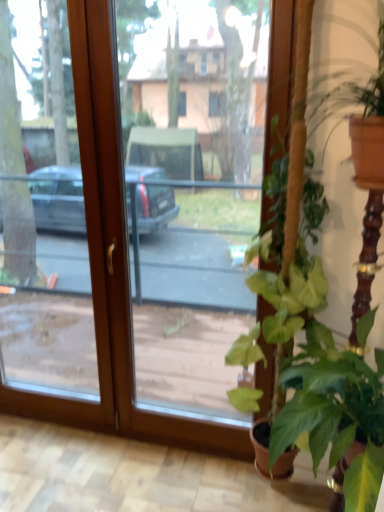
Describe the element at coordinates (355, 103) in the screenshot. I see `green leafy plant at right, acting as the first houseplant starting from the top` at that location.

Locate an element on the screen. green leafy plant at right, acting as the first houseplant starting from the top is located at coordinates (355, 103).

Identify the location of green leafy plant at lower right, marked as the third houseplant in a top-to-bottom arrangement. (335, 414).

Does green leafy plant at right, acting as the first houseplant starting from the top, turn towards green leafy plant at lower right, which is the first houseplant in bottom-to-top order?

No, green leafy plant at right, acting as the first houseplant starting from the top, is not facing towards green leafy plant at lower right, which is the first houseplant in bottom-to-top order.

Consider the image. Which object is positioned more to the left, green leafy plant at right, acting as the first houseplant starting from the top, or green leafy plant at lower right, which is the first houseplant in bottom-to-top order?

Result: green leafy plant at right, acting as the first houseplant starting from the top.

Is green leafy plant at right, which is the 3th houseplant from bottom to top, not near green leafy plant at lower right, marked as the third houseplant in a top-to-bottom arrangement?

Actually, green leafy plant at right, which is the 3th houseplant from bottom to top, and green leafy plant at lower right, marked as the third houseplant in a top-to-bottom arrangement, are a little close together.

From a real-world perspective, who is located lower, green leafy plant at right, which is the 3th houseplant from bottom to top, or green leafy plant at lower right, which is the first houseplant in bottom-to-top order?

green leafy plant at lower right, which is the first houseplant in bottom-to-top order.

Between green leafy plant at lower right, marked as the third houseplant in a top-to-bottom arrangement, and green matte plant at right, arranged as the second houseplant when ordered from the bottom, which one has larger width?

green leafy plant at lower right, marked as the third houseplant in a top-to-bottom arrangement, is wider.

Are green leafy plant at lower right, which is the first houseplant in bottom-to-top order, and green matte plant at right, arranged as the second houseplant when ordered from the bottom, located far from each other?

No, green leafy plant at lower right, which is the first houseplant in bottom-to-top order, is not far away from green matte plant at right, arranged as the second houseplant when ordered from the bottom.

Is green matte plant at right, arranged as the second houseplant when ordered from the bottom, at the back of green leafy plant at lower right, which is the first houseplant in bottom-to-top order?

green leafy plant at lower right, which is the first houseplant in bottom-to-top order, is not turned away from green matte plant at right, arranged as the second houseplant when ordered from the bottom.

Would you say green leafy plant at lower right, which is the first houseplant in bottom-to-top order, is inside or outside green matte plant at right, which appears as the second houseplant when viewed from the top?

green leafy plant at lower right, which is the first houseplant in bottom-to-top order, is not inside green matte plant at right, which appears as the second houseplant when viewed from the top, it's outside.

Can you confirm if green matte plant at right, which appears as the second houseplant when viewed from the top, is thinner than green leafy plant at right, which is the 3th houseplant from bottom to top?

No.

Would you say green leafy plant at right, which is the 3th houseplant from bottom to top, is part of green matte plant at right, which appears as the second houseplant when viewed from the top,'s contents?

No, green leafy plant at right, which is the 3th houseplant from bottom to top, is not inside green matte plant at right, which appears as the second houseplant when viewed from the top.

Are green matte plant at right, arranged as the second houseplant when ordered from the bottom, and green leafy plant at right, which is the 3th houseplant from bottom to top, beside each other?

There is a gap between green matte plant at right, arranged as the second houseplant when ordered from the bottom, and green leafy plant at right, which is the 3th houseplant from bottom to top.

From a real-world perspective, is green matte plant at right, arranged as the second houseplant when ordered from the bottom, located beneath green leafy plant at right, which is the 3th houseplant from bottom to top?

Yes.

Is green leafy plant at lower right, marked as the third houseplant in a top-to-bottom arrangement, positioned behind green leafy plant at right, acting as the first houseplant starting from the top?

No, the depth of green leafy plant at lower right, marked as the third houseplant in a top-to-bottom arrangement, is less than that of green leafy plant at right, acting as the first houseplant starting from the top.

From their relative heights in the image, would you say green leafy plant at lower right, which is the first houseplant in bottom-to-top order, is taller or shorter than green leafy plant at right, which is the 3th houseplant from bottom to top?

Clearly, green leafy plant at lower right, which is the first houseplant in bottom-to-top order, is taller compared to green leafy plant at right, which is the 3th houseplant from bottom to top.

Which point is more distant from viewer, (x=319, y=333) or (x=337, y=89)?

The point (x=337, y=89) is behind.

Between green leafy plant at lower right, which is the first houseplant in bottom-to-top order, and green leafy plant at right, which is the 3th houseplant from bottom to top, which one has larger width?

With larger width is green leafy plant at lower right, which is the first houseplant in bottom-to-top order.

From a real-world perspective, does green matte plant at right, arranged as the second houseplant when ordered from the bottom, stand above green leafy plant at lower right, marked as the third houseplant in a top-to-bottom arrangement?

No.

How many degrees apart are the facing directions of green matte plant at right, which appears as the second houseplant when viewed from the top, and green leafy plant at lower right, marked as the third houseplant in a top-to-bottom arrangement?

The angular difference between green matte plant at right, which appears as the second houseplant when viewed from the top, and green leafy plant at lower right, marked as the third houseplant in a top-to-bottom arrangement, is 0.185 degrees.

Considering the relative sizes of green matte plant at right, which appears as the second houseplant when viewed from the top, and green leafy plant at lower right, marked as the third houseplant in a top-to-bottom arrangement, in the image provided, is green matte plant at right, which appears as the second houseplant when viewed from the top, taller than green leafy plant at lower right, marked as the third houseplant in a top-to-bottom arrangement,?

Correct, green matte plant at right, which appears as the second houseplant when viewed from the top, is much taller as green leafy plant at lower right, marked as the third houseplant in a top-to-bottom arrangement.

Which is more distant, (323, 436) or (82, 45)?

The point (82, 45) is more distant.

How different are the orientations of green leafy plant at lower right, marked as the third houseplant in a top-to-bottom arrangement, and transparent glass door at center in degrees?

87.9 degrees.

From the picture: From a real-world perspective, is green leafy plant at lower right, marked as the third houseplant in a top-to-bottom arrangement, above or below transparent glass door at center?

Clearly, from a real-world perspective, green leafy plant at lower right, marked as the third houseplant in a top-to-bottom arrangement, is below transparent glass door at center.

Considering the positions of objects green leafy plant at lower right, which is the first houseplant in bottom-to-top order, and transparent glass door at center in the image provided, who is more to the left, green leafy plant at lower right, which is the first houseplant in bottom-to-top order, or transparent glass door at center?

transparent glass door at center is more to the left.

Which object is wider, green matte plant at right, which appears as the second houseplant when viewed from the top, or transparent glass door at center?

green matte plant at right, which appears as the second houseplant when viewed from the top.

Considering the relative sizes of green matte plant at right, arranged as the second houseplant when ordered from the bottom, and transparent glass door at center in the image provided, is green matte plant at right, arranged as the second houseplant when ordered from the bottom, bigger than transparent glass door at center?

Actually, green matte plant at right, arranged as the second houseplant when ordered from the bottom, might be smaller than transparent glass door at center.

Locate an element on the screen. The image size is (384, 512). window above the green matte plant at right, which appears as the second houseplant when viewed from the top (from the image's perspective) is located at coordinates (112, 265).

Is green matte plant at right, which appears as the second houseplant when viewed from the top, facing away from transparent glass door at center?

No, green matte plant at right, which appears as the second houseplant when viewed from the top, is not facing the opposite direction of transparent glass door at center.

Identify the location of houseplant above the green leafy plant at lower right, marked as the third houseplant in a top-to-bottom arrangement (from a real-world perspective). Image resolution: width=384 pixels, height=512 pixels. (355, 103).

The height and width of the screenshot is (512, 384). I want to click on the 2nd houseplant in front of the green matte plant at right, arranged as the second houseplant when ordered from the bottom, so click(335, 414).

When comparing their distances from green leafy plant at right, acting as the first houseplant starting from the top, does green leafy plant at lower right, which is the first houseplant in bottom-to-top order, or transparent glass door at center seem closer?

green leafy plant at lower right, which is the first houseplant in bottom-to-top order, is closer to green leafy plant at right, acting as the first houseplant starting from the top.

Which object lies further to the anchor point green leafy plant at right, acting as the first houseplant starting from the top, green matte plant at right, arranged as the second houseplant when ordered from the bottom, or green leafy plant at lower right, marked as the third houseplant in a top-to-bottom arrangement?

Based on the image, green leafy plant at lower right, marked as the third houseplant in a top-to-bottom arrangement, appears to be further to green leafy plant at right, acting as the first houseplant starting from the top.

Estimate the real-world distances between objects in this image. Which object is further from green leafy plant at lower right, marked as the third houseplant in a top-to-bottom arrangement, green matte plant at right, which appears as the second houseplant when viewed from the top, or green leafy plant at right, acting as the first houseplant starting from the top?

green leafy plant at right, acting as the first houseplant starting from the top, is positioned further to the anchor green leafy plant at lower right, marked as the third houseplant in a top-to-bottom arrangement.

Based on their spatial positions, is green leafy plant at lower right, which is the first houseplant in bottom-to-top order, or green leafy plant at right, which is the 3th houseplant from bottom to top, closer to green matte plant at right, arranged as the second houseplant when ordered from the bottom?

green leafy plant at lower right, which is the first houseplant in bottom-to-top order.

Which object lies nearer to the anchor point transparent glass door at center, green leafy plant at lower right, which is the first houseplant in bottom-to-top order, or green leafy plant at right, which is the 3th houseplant from bottom to top?

green leafy plant at lower right, which is the first houseplant in bottom-to-top order, lies closer to transparent glass door at center than the other object.

Which object lies nearer to the anchor point green leafy plant at right, which is the 3th houseplant from bottom to top, transparent glass door at center or green matte plant at right, arranged as the second houseplant when ordered from the bottom?

green matte plant at right, arranged as the second houseplant when ordered from the bottom.

From the image, which object appears to be nearer to green leafy plant at lower right, marked as the third houseplant in a top-to-bottom arrangement, green leafy plant at right, acting as the first houseplant starting from the top, or green matte plant at right, which appears as the second houseplant when viewed from the top?

green matte plant at right, which appears as the second houseplant when viewed from the top, is positioned closer to the anchor green leafy plant at lower right, marked as the third houseplant in a top-to-bottom arrangement.

Estimate the real-world distances between objects in this image. Which object is further from green leafy plant at lower right, which is the first houseplant in bottom-to-top order, green leafy plant at right, which is the 3th houseplant from bottom to top, or transparent glass door at center?

Among the two, transparent glass door at center is located further to green leafy plant at lower right, which is the first houseplant in bottom-to-top order.

The height and width of the screenshot is (512, 384). Identify the location of window between green leafy plant at right, which is the 3th houseplant from bottom to top, and green matte plant at right, which appears as the second houseplant when viewed from the top, in the up-down direction. [x=112, y=265].

I want to click on houseplant between green leafy plant at right, which is the 3th houseplant from bottom to top, and green leafy plant at lower right, which is the first houseplant in bottom-to-top order, in the vertical direction, so click(288, 269).